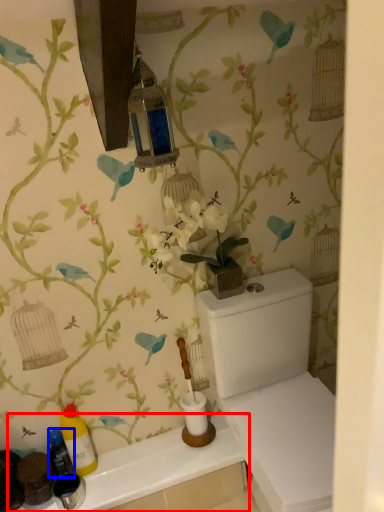
Question: Which point is further to the camera, counter top (highlighted by a red box) or bottle (highlighted by a blue box)?

Choices:
 (A) counter top
 (B) bottle

Answer: (B)